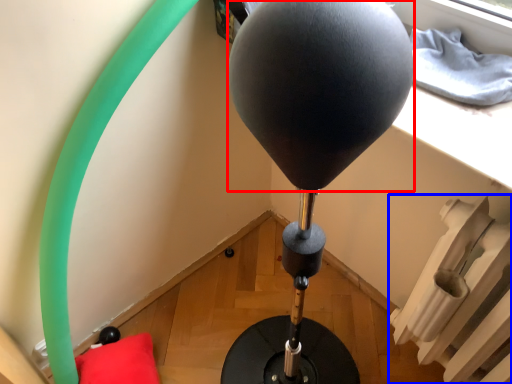
Question: Which of the following is the farthest to the observer, balloon (highlighted by a red box) or radiator (highlighted by a blue box)?

Choices:
 (A) balloon
 (B) radiator

Answer: (A)